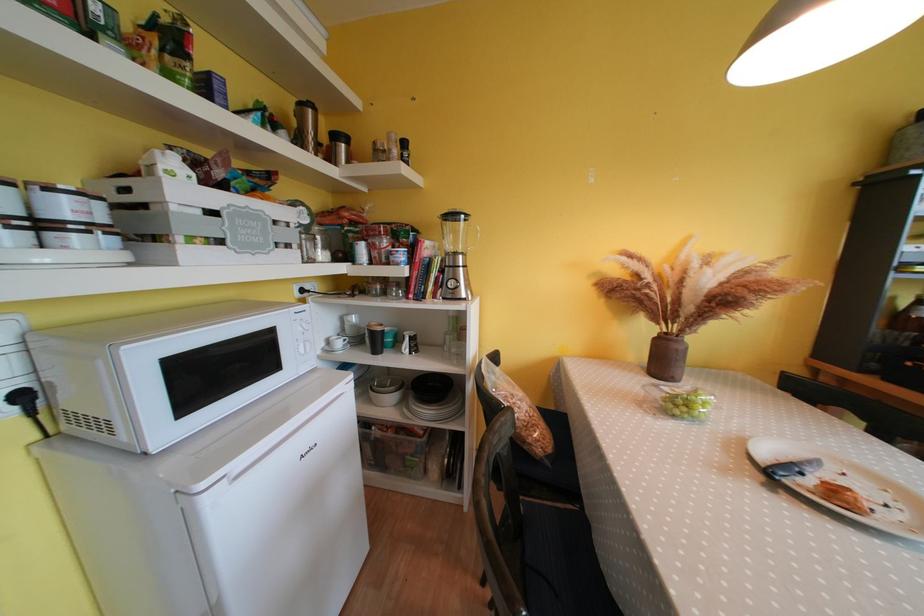
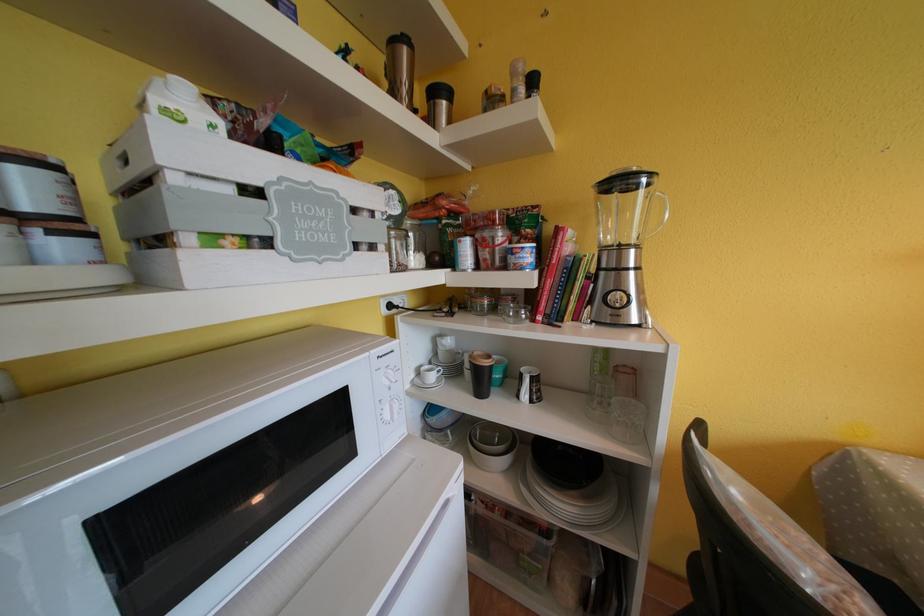
Where in the second image is the point corresponding to [308,108] from the first image?

(399, 46)